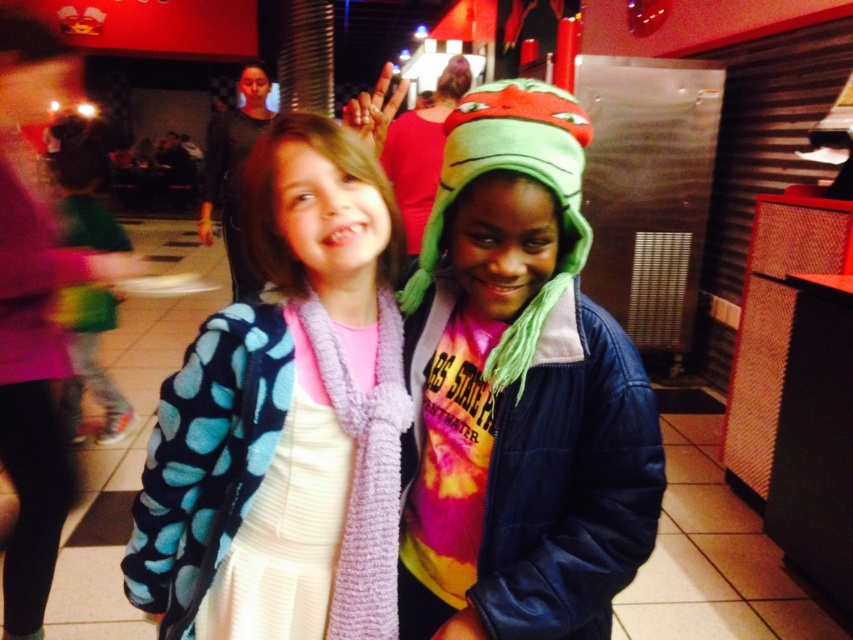
Based on the photo, you are a photographer trying to capture a photo of the two children. You want to ensure that the green plush hat at center and the blue polka dot fleece jacket at center are both visible in the frame. Based on their positions, which object should you focus on first to make sure both are in the shot?

The green plush hat at center is above the blue polka dot fleece jacket at center, so you should focus on the green plush hat at center first to ensure both are in the frame.

You are a photographer trying to capture the perfect shot of the green plush hat at center. Based on the scene description, where should you position your camera to ensure the hat is in the frame?

The green plush hat at center is located at point (x=519, y=390), so position the camera to focus on that coordinate to capture the hat in the frame.

You are a photographer trying to capture a clear photo of both the green plush hat at center and the blue polka dot fleece jacket at center. Since the camera can only focus on one object at a time, which object should you focus on to ensure it appears larger in the photo?

The green plush hat at center is taller than the blue polka dot fleece jacket at center, so focusing on the green plush hat at center will ensure it appears larger in the photo.